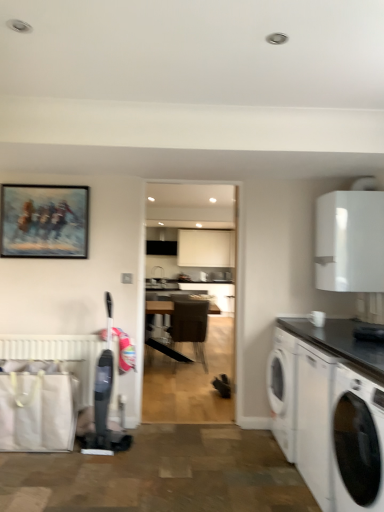
You are a GUI agent. You are given a task and a screenshot of the screen. Output one action in this format:
    pyautogui.click(x=<x>, y=<y>)
    Task: Click on the free space above oil painting at upper left (from a real-world perspective)
    The width and height of the screenshot is (384, 512).
    Given the screenshot: What is the action you would take?
    pyautogui.click(x=46, y=180)